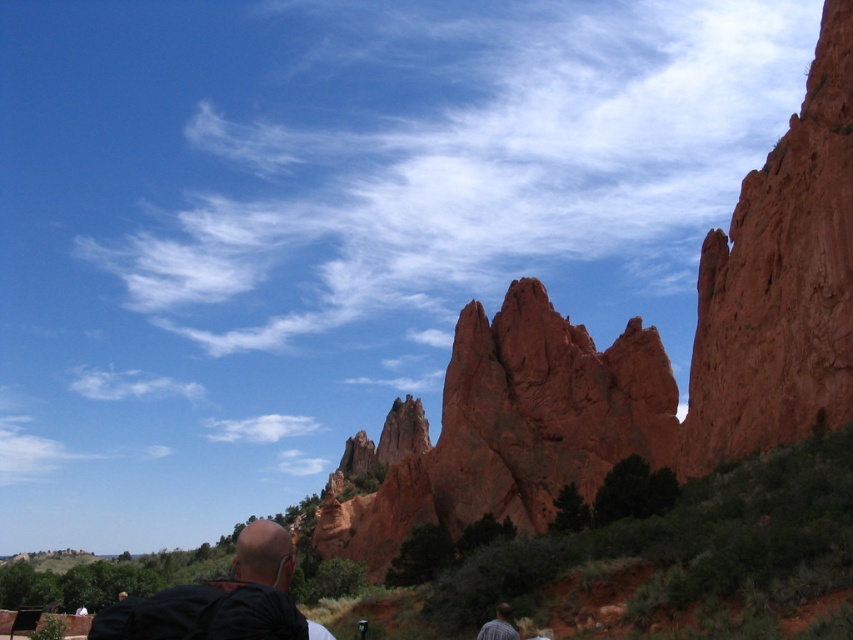
Measure the distance between black leather jacket at lower left and light brown hair at lower center.

They are 20.45 meters apart.

Can you confirm if black leather jacket at lower left is positioned to the right of light brown hair at lower center?

In fact, black leather jacket at lower left is to the left of light brown hair at lower center.

What do you see at coordinates (221, 600) in the screenshot? Image resolution: width=853 pixels, height=640 pixels. I see `black leather jacket at lower left` at bounding box center [221, 600].

Locate an element on the screen. black leather jacket at lower left is located at coordinates (221, 600).

Who is positioned more to the right, rustic sandstone rock formation at center or light brown hair at lower center?

light brown hair at lower center

Is point (419, 442) farther from viewer compared to point (512, 630)?

Yes.

Where is `rustic sandstone rock formation at center`? The width and height of the screenshot is (853, 640). rustic sandstone rock formation at center is located at coordinates (505, 429).

Does rustic sandstone rock formation at center have a greater height compared to black leather jacket at lower left?

Correct, rustic sandstone rock formation at center is much taller as black leather jacket at lower left.

Which is more to the right, rustic sandstone rock formation at center or black leather jacket at lower left?

From the viewer's perspective, rustic sandstone rock formation at center appears more on the right side.

The height and width of the screenshot is (640, 853). What do you see at coordinates (505, 429) in the screenshot?
I see `rustic sandstone rock formation at center` at bounding box center [505, 429].

This screenshot has height=640, width=853. I want to click on rustic sandstone rock formation at center, so click(x=505, y=429).